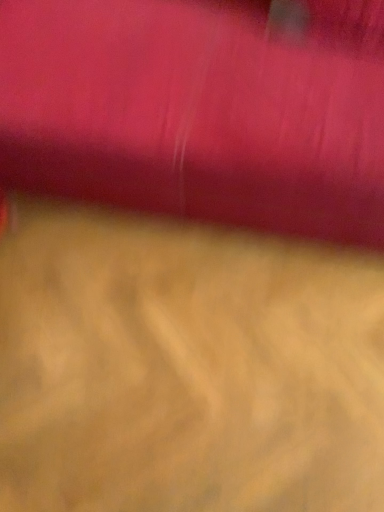
The image size is (384, 512). What do you see at coordinates (198, 112) in the screenshot? I see `matte pink curtain at upper center` at bounding box center [198, 112].

The width and height of the screenshot is (384, 512). Identify the location of matte pink curtain at upper center. (198, 112).

In order to face wooden floor at center, should I rotate leftwards or rightwards?

You should rotate left by 4.558 degrees.

The height and width of the screenshot is (512, 384). What do you see at coordinates (185, 368) in the screenshot?
I see `wooden floor at center` at bounding box center [185, 368].

Measure the distance between wooden floor at center and camera.

wooden floor at center and camera are 3.34 feet apart.

In order to click on wooden floor at center in this screenshot , I will do `click(185, 368)`.

In order to click on matte pink curtain at upper center in this screenshot , I will do `click(198, 112)`.

In the image, is wooden floor at center on the left side or the right side of matte pink curtain at upper center?

Based on their positions, wooden floor at center is located to the left of matte pink curtain at upper center.

Does wooden floor at center come in front of matte pink curtain at upper center?

No.

Which point is more distant from viewer, (162, 460) or (321, 218)?

The point (321, 218) is more distant.

From the image's perspective, is wooden floor at center on matte pink curtain at upper center?

No, from the image's perspective, wooden floor at center is not above matte pink curtain at upper center.

From a real-world perspective, which object rests below the other?

wooden floor at center.

Which object is thinner, wooden floor at center or matte pink curtain at upper center?

matte pink curtain at upper center is thinner.

Is wooden floor at center shorter than matte pink curtain at upper center?

Yes.

Does wooden floor at center have a larger size compared to matte pink curtain at upper center?

No.

Consider the image. Can matte pink curtain at upper center be found inside wooden floor at center?

Actually, matte pink curtain at upper center is outside wooden floor at center.

Is wooden floor at center far from matte pink curtain at upper center?

No.

Is wooden floor at center facing away from matte pink curtain at upper center?

No.

Locate an element on the screen. curtain above the wooden floor at center (from the image's perspective) is located at coordinates (198, 112).

Is matte pink curtain at upper center at the left side of wooden floor at center?

No, matte pink curtain at upper center is not to the left of wooden floor at center.

Relative to wooden floor at center, is matte pink curtain at upper center in front or behind?

Clearly, matte pink curtain at upper center is in front of wooden floor at center.

Considering the positions of points (41, 108) and (8, 391), is point (41, 108) farther from camera compared to point (8, 391)?

No, it is not.

From the image's perspective, between matte pink curtain at upper center and wooden floor at center, which one is located above?

matte pink curtain at upper center appears higher in the image.

From a real-world perspective, which is physically below, matte pink curtain at upper center or wooden floor at center?

A: In real-world perspective, wooden floor at center is lower.

Which object is thinner, matte pink curtain at upper center or wooden floor at center?

matte pink curtain at upper center.

Considering the sizes of objects matte pink curtain at upper center and wooden floor at center in the image provided, who is taller, matte pink curtain at upper center or wooden floor at center?

matte pink curtain at upper center is taller.

Can you confirm if matte pink curtain at upper center is bigger than wooden floor at center?

Indeed, matte pink curtain at upper center has a larger size compared to wooden floor at center.

From the picture: Is matte pink curtain at upper center completely or partially outside of wooden floor at center?

Yes, matte pink curtain at upper center is located beyond the bounds of wooden floor at center.

Is matte pink curtain at upper center next to wooden floor at center?

matte pink curtain at upper center and wooden floor at center are clearly separated.

Is matte pink curtain at upper center facing towards wooden floor at center?

Yes, matte pink curtain at upper center is facing wooden floor at center.

Locate an element on the screen. Image resolution: width=384 pixels, height=512 pixels. surface that appears below the matte pink curtain at upper center (from a real-world perspective) is located at coordinates (185, 368).

Identify the location of curtain above the wooden floor at center (from the image's perspective). (x=198, y=112).

Locate an element on the screen. Image resolution: width=384 pixels, height=512 pixels. surface directly beneath the matte pink curtain at upper center (from a real-world perspective) is located at coordinates (185, 368).